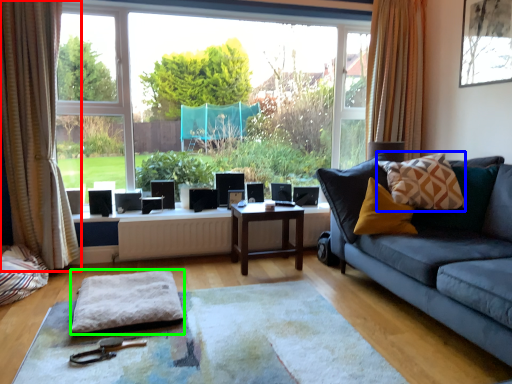
Question: Estimate the real-world distances between objects in this image. Which object is farther from curtain (highlighted by a red box), throw pillow (highlighted by a blue box) or footrest (highlighted by a green box)?

Choices:
 (A) throw pillow
 (B) footrest

Answer: (A)